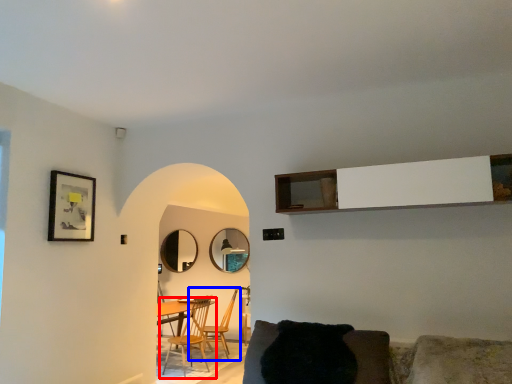
Question: Which point is closer to the camera, chair (highlighted by a red box) or chair (highlighted by a blue box)?

Choices:
 (A) chair
 (B) chair

Answer: (A)